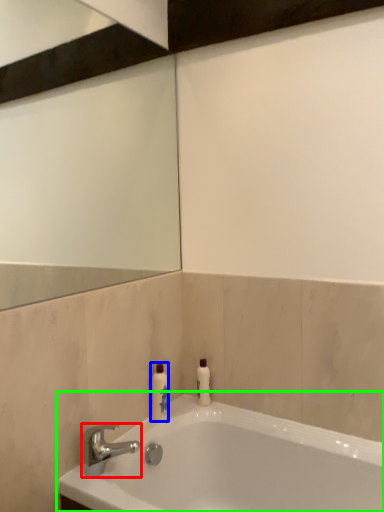
Question: Which is farther away from tap (highlighted by a red box)? toiletry (highlighted by a blue box) or bathtub (highlighted by a green box)?

Choices:
 (A) toiletry
 (B) bathtub

Answer: (B)